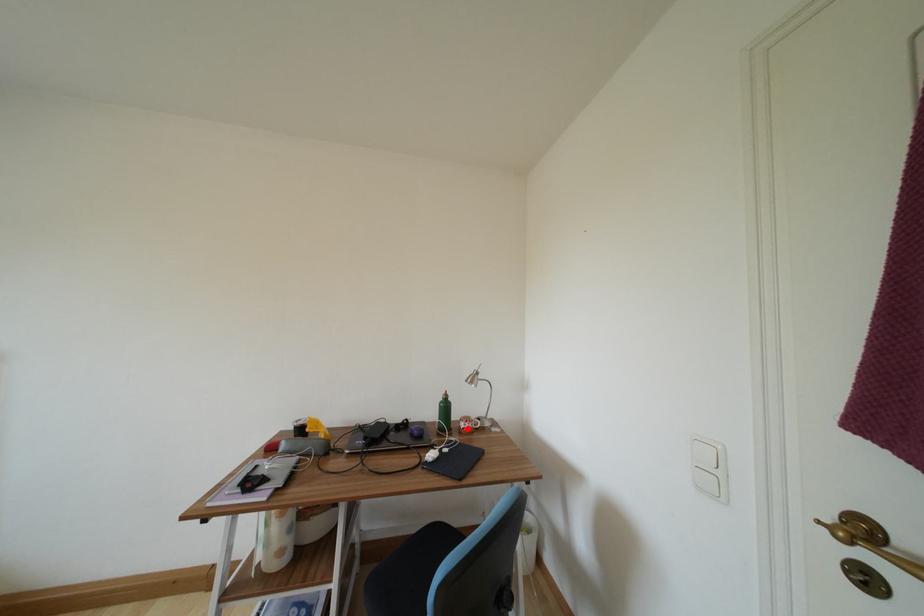
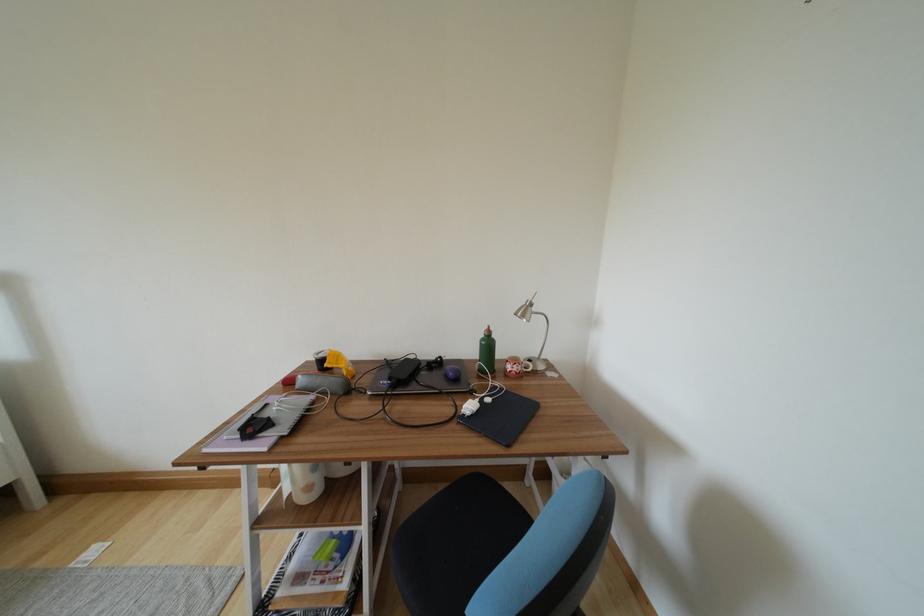
Find the pixel in the second image that matches the highlighted location in the first image.

(514, 371)